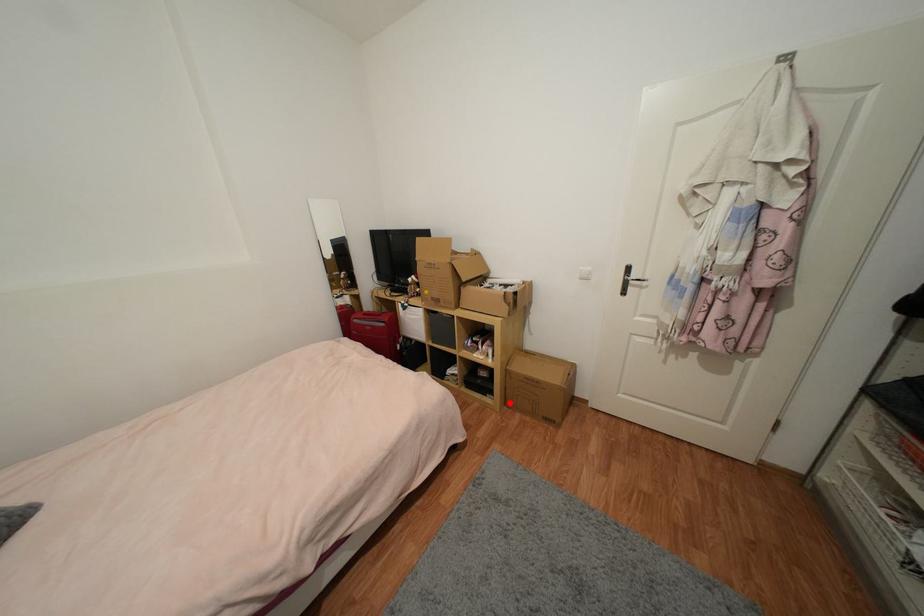
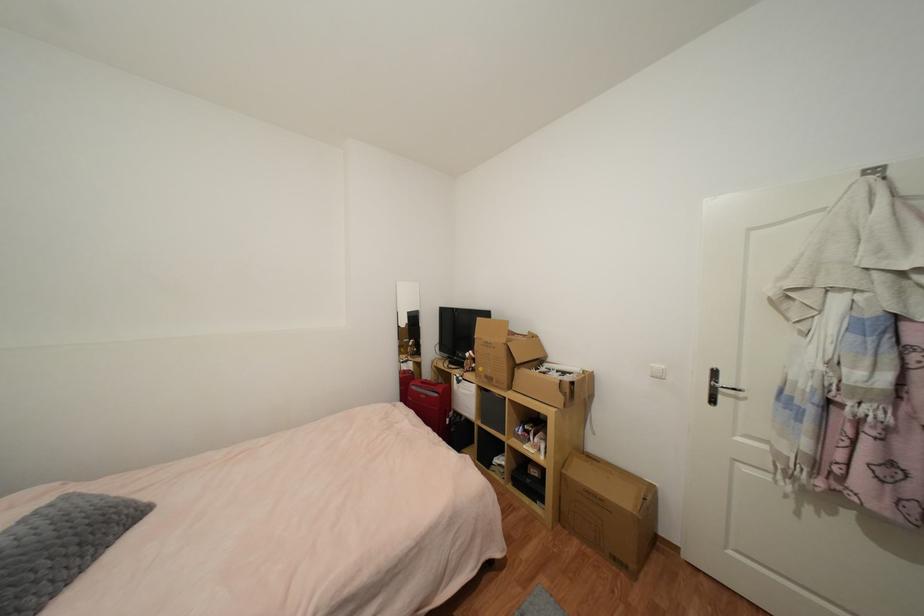
Question: A red point is marked in image1. In image2, is the corresponding 3D point closer to the camera or farther? Reply with the corresponding letter.

Choices:
 (A) The corresponding 3D point is closer.
 (B) The corresponding 3D point is farther.

Answer: (A)